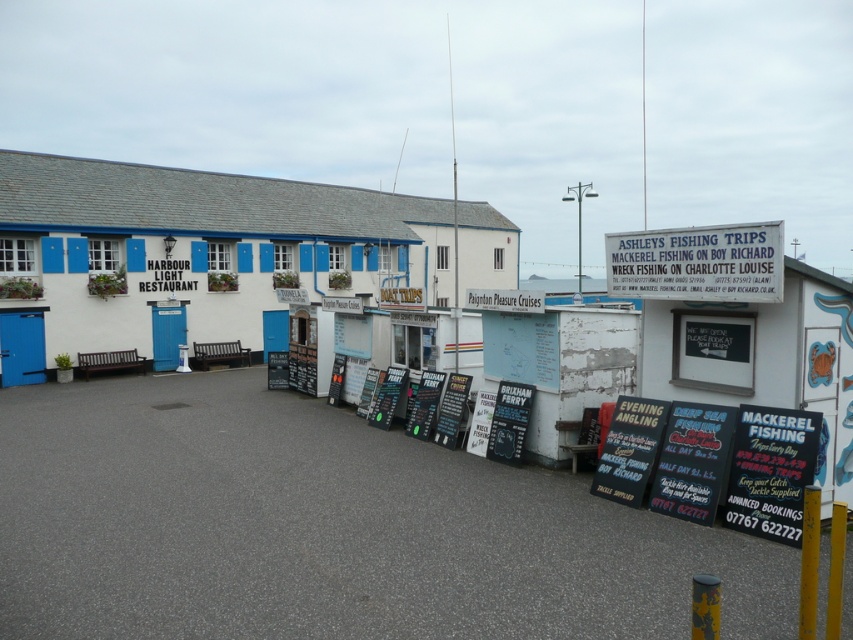
You are standing at the Harbour Light Restaurant and want to reach the boat trip signs. Which direction should you walk to first move away from point (317, 260) and then towards point (727, 493)?

First move away from point (317, 260) by walking towards the direction opposite to it, then head towards point (727, 493) since it is in front of point (317, 260).

You are standing at the point labeled point (517, 396) and want to walk towards the point labeled point (664, 280). Which direction should you move to get closer to it?

You should move towards the point labeled point (664, 280) by walking in the direction that brings you closer to it, since it is closer to the camera than your current position at point (517, 396).

You are a tourist looking for a boat trip and see the white painted signboard at upper right and the black plastic sign at center. Which one is larger?

The white painted signboard at upper right is bigger than the black plastic sign at center.